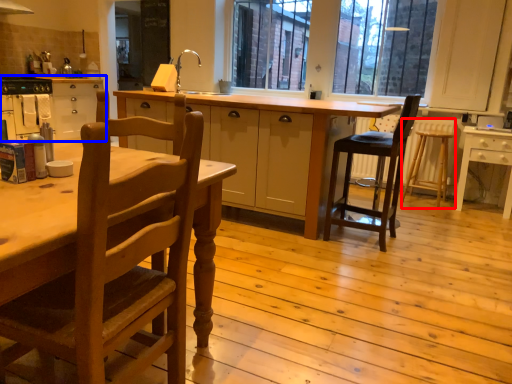
Question: Which point is further to the camera, bar stool (highlighted by a red box) or cabinetry (highlighted by a blue box)?

Choices:
 (A) bar stool
 (B) cabinetry

Answer: (B)